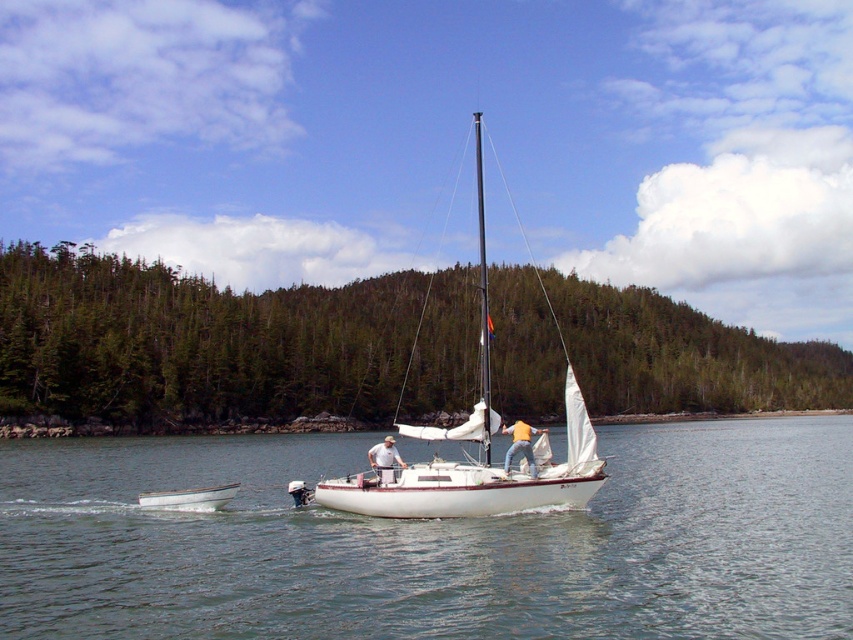
Looking at this image, you are a photographer trying to capture both the white matte dinghy at lower left and the white fabric sailboat at center in a single shot. Which boat should you focus on first to ensure both are in frame?

The white matte dinghy at lower left is shorter than the white fabric sailboat at center, so you should focus on the white fabric sailboat at center first to ensure both are in frame.